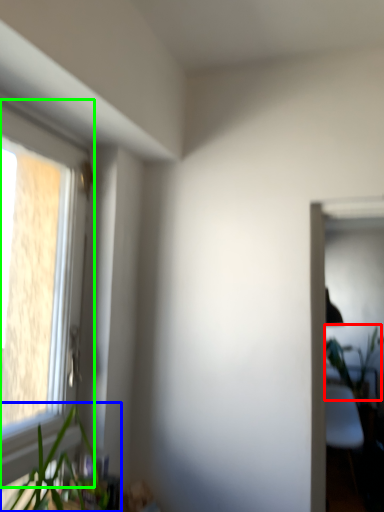
Question: Which object is the closest to the vegetation (highlighted by a red box)? Choose among these: houseplant (highlighted by a blue box) or window (highlighted by a green box).

Choices:
 (A) houseplant
 (B) window

Answer: (A)